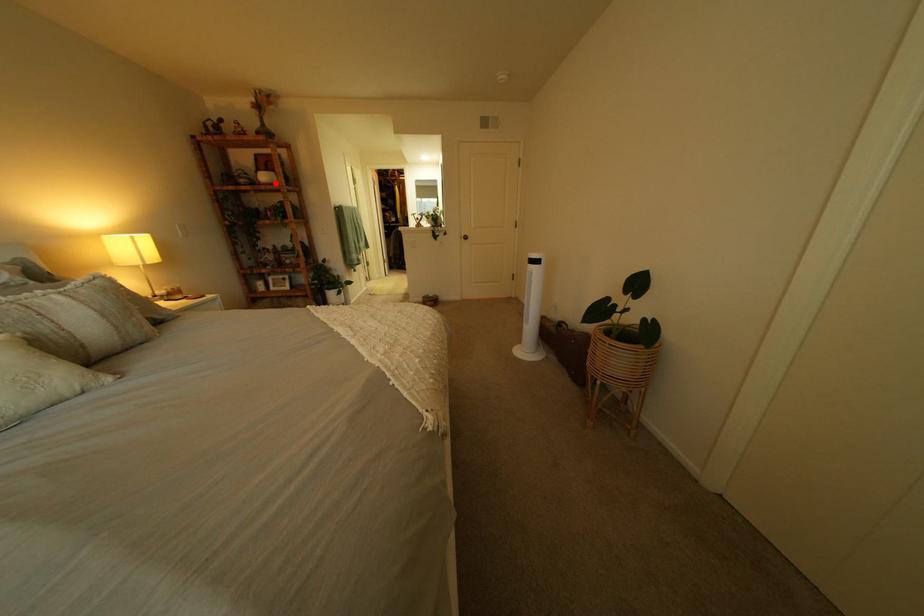
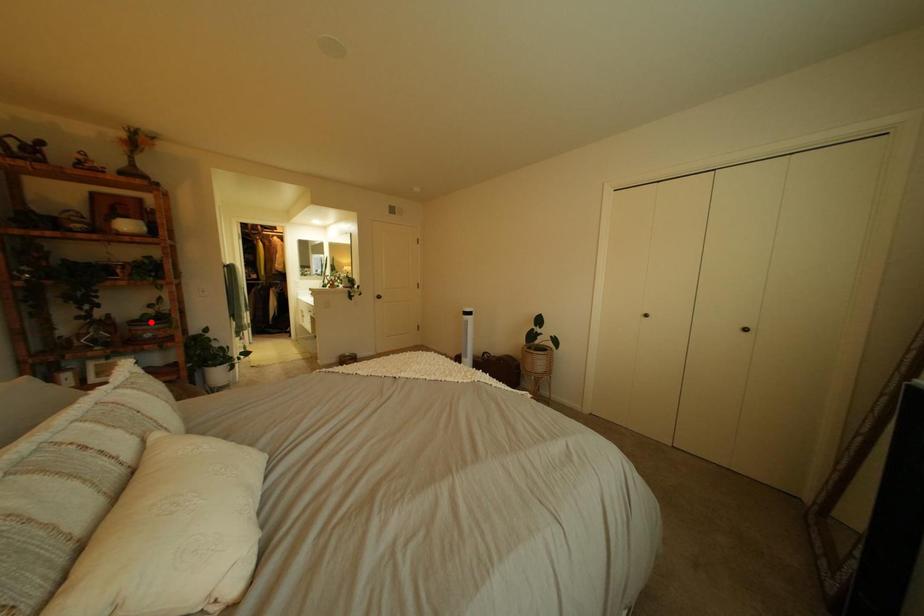
I am providing you with two images of the same scene from different viewpoints. A red point is marked on the first image and another point is marked on the second image. Does the point marked in image1 correspond to the same location as the one in image2?

No